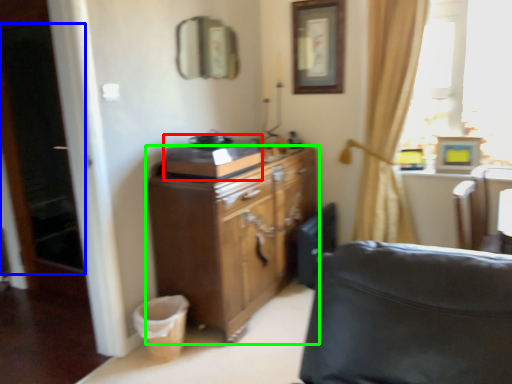
Question: Estimate the real-world distances between objects in this image. Which object is farther from appliance (highlighted by a red box), screen door (highlighted by a blue box) or cabinetry (highlighted by a green box)?

Choices:
 (A) screen door
 (B) cabinetry

Answer: (A)